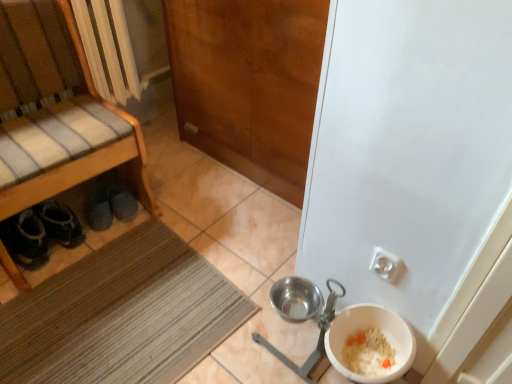
Find the location of a particular element. The height and width of the screenshot is (384, 512). white plastic bowl at lower right is located at coordinates (364, 329).

Find the location of a particular element. dark gray fabric shoes at lower left is located at coordinates (99, 206).

Find the location of `wooden bench at left`. wooden bench at left is located at coordinates (57, 112).

Based on the photo, is dark gray fabric shoes at lower left aimed at wooden bench at left?

Yes, dark gray fabric shoes at lower left is facing wooden bench at left.

From a real-world perspective, is dark gray fabric shoes at lower left under wooden bench at left?

Yes, from a real-world perspective, dark gray fabric shoes at lower left is beneath wooden bench at left.

Is dark gray fabric shoes at lower left situated inside wooden bench at left or outside?

The correct answer is: inside.

Is dark gray fabric shoes at lower left at the right side of wooden bench at left?

Indeed, dark gray fabric shoes at lower left is positioned on the right side of wooden bench at left.

Based on the photo, which object is further away from the camera, white plastic bowl at lower right or brown textured mat at lower left?

Positioned behind is brown textured mat at lower left.

Is white plastic bowl at lower right not close to brown textured mat at lower left?

white plastic bowl at lower right is actually quite close to brown textured mat at lower left.

Does white plastic bowl at lower right have a smaller size compared to brown textured mat at lower left?

Yes.

Would you say wooden door at center is inside or outside white plastic bowl at lower right?

The correct answer is: outside.

Between wooden door at center and white plastic bowl at lower right, which one appears on the left side from the viewer's perspective?

wooden door at center.

Considering the relative sizes of wooden door at center and white plastic bowl at lower right in the image provided, is wooden door at center taller than white plastic bowl at lower right?

Yes.

Is wooden door at center positioned with its back to white plastic bowl at lower right?

No, white plastic bowl at lower right is not at the back of wooden door at center.

Is dark gray fabric shoes at lower left next to white plastic bowl at lower right?

No.

Measure the distance from dark gray fabric shoes at lower left to white plastic bowl at lower right.

dark gray fabric shoes at lower left is 1.10 meters away from white plastic bowl at lower right.

Could you tell me if dark gray fabric shoes at lower left is facing white plastic bowl at lower right?

No, dark gray fabric shoes at lower left is not oriented towards white plastic bowl at lower right.

Considering the relative positions of dark gray fabric shoes at lower left and white plastic bowl at lower right in the image provided, is dark gray fabric shoes at lower left to the left or to the right of white plastic bowl at lower right?

dark gray fabric shoes at lower left is to the left of white plastic bowl at lower right.

Locate an element on the screen. footwear above the brown textured mat at lower left (from a real-world perspective) is located at coordinates (99, 206).

How far apart are dark gray fabric shoes at lower left and brown textured mat at lower left?

The distance of dark gray fabric shoes at lower left from brown textured mat at lower left is 17.26 inches.

Between dark gray fabric shoes at lower left and brown textured mat at lower left, which one has more height?

With more height is dark gray fabric shoes at lower left.

From the image's perspective, which one is positioned higher, dark gray fabric shoes at lower left or brown textured mat at lower left?

dark gray fabric shoes at lower left appears higher in the image.

Would you say brown textured mat at lower left is inside or outside dark gray fabric shoes at lower left?

brown textured mat at lower left is outside dark gray fabric shoes at lower left.

Does brown textured mat at lower left come behind dark gray fabric shoes at lower left?

No, brown textured mat at lower left is closer to the camera.

Is brown textured mat at lower left oriented towards dark gray fabric shoes at lower left?

No, brown textured mat at lower left is not facing towards dark gray fabric shoes at lower left.

From the image's perspective, is brown textured mat at lower left positioned above or below dark gray fabric shoes at lower left?

brown textured mat at lower left is situated lower than dark gray fabric shoes at lower left in the image.

Which is further, (248, 50) or (68, 28)?

The point (68, 28) is behind.

Visually, is wooden door at center positioned to the left or to the right of wooden bench at left?

From the image, it's evident that wooden door at center is to the right of wooden bench at left.

Identify the location of door behind the wooden bench at left. This screenshot has height=384, width=512. (249, 83).

The width and height of the screenshot is (512, 384). I want to click on footwear that appears on the right of wooden bench at left, so click(x=99, y=206).

Where is `mat below the white plastic bowl at lower right (from a real-world perspective)`? mat below the white plastic bowl at lower right (from a real-world perspective) is located at coordinates (121, 315).

Estimate the real-world distances between objects in this image. Which object is further from white plastic bowl at lower right, brown textured mat at lower left or wooden door at center?

wooden door at center.

From the image, which object appears to be farther from dark gray fabric shoes at lower left, wooden bench at left or brown textured mat at lower left?

brown textured mat at lower left lies further to dark gray fabric shoes at lower left than the other object.

From the picture: Which object lies nearer to the anchor point wooden bench at left, wooden door at center or white plastic bowl at lower right?

wooden door at center is closer to wooden bench at left.

Estimate the real-world distances between objects in this image. Which object is closer to white plastic bowl at lower right, dark gray fabric shoes at lower left or wooden door at center?

Among the two, wooden door at center is located nearer to white plastic bowl at lower right.

Looking at the image, which one is located closer to white plastic bowl at lower right, dark gray fabric shoes at lower left or brown textured mat at lower left?

Based on the image, brown textured mat at lower left appears to be nearer to white plastic bowl at lower right.

Considering their positions, is wooden bench at left positioned closer to wooden door at center than brown textured mat at lower left?

wooden bench at left is positioned closer to the anchor wooden door at center.

Estimate the real-world distances between objects in this image. Which object is closer to dark gray fabric shoes at lower left, brown textured mat at lower left or wooden bench at left?

Based on the image, wooden bench at left appears to be nearer to dark gray fabric shoes at lower left.

Estimate the real-world distances between objects in this image. Which object is closer to dark gray fabric shoes at lower left, white plastic bowl at lower right or brown textured mat at lower left?

Among the two, brown textured mat at lower left is located nearer to dark gray fabric shoes at lower left.

This screenshot has height=384, width=512. I want to click on mat positioned between wooden bench at left and dark gray fabric shoes at lower left from near to far, so click(121, 315).

You are a GUI agent. You are given a task and a screenshot of the screen. Output one action in this format:
    pyautogui.click(x=<x>, y=<y>)
    Task: Click on the basin between wooden door at center and brown textured mat at lower left in the up-down direction
    
    Given the screenshot: What is the action you would take?
    pyautogui.click(x=364, y=329)

I want to click on mat situated between dark gray fabric shoes at lower left and white plastic bowl at lower right from left to right, so click(121, 315).

What are the coordinates of `door located between wooden bench at left and white plastic bowl at lower right in the left-right direction` in the screenshot? It's located at (249, 83).